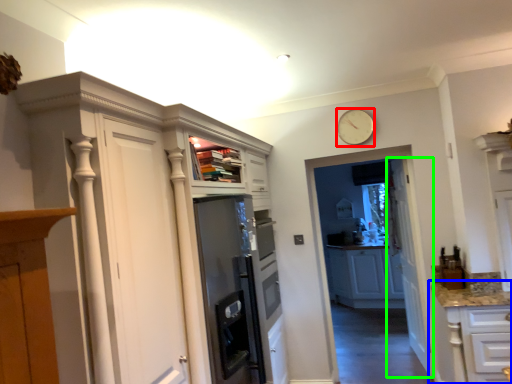
Question: Considering the real-world distances, which object is farthest from clock (highlighted by a red box)? cabinetry (highlighted by a blue box) or door (highlighted by a green box)?

Choices:
 (A) cabinetry
 (B) door

Answer: (A)